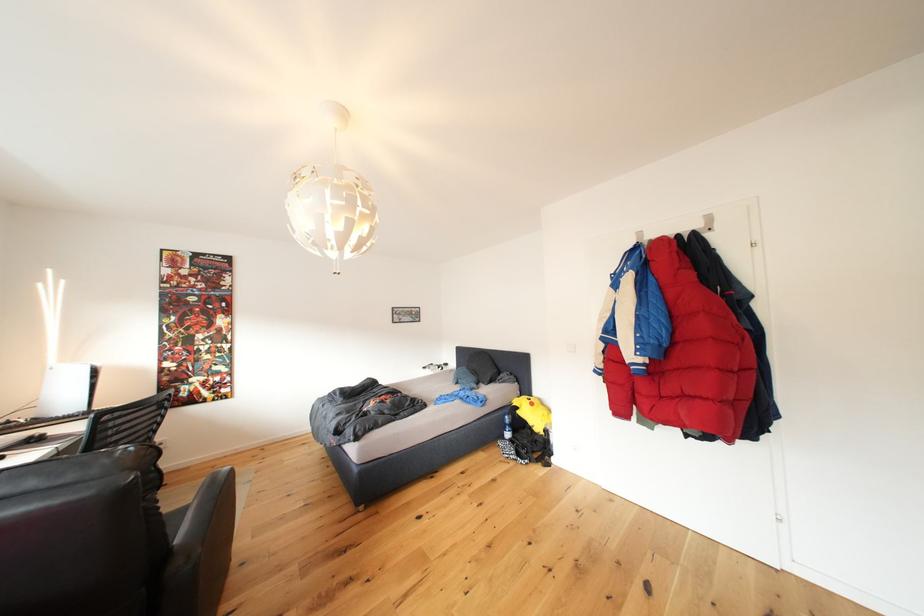
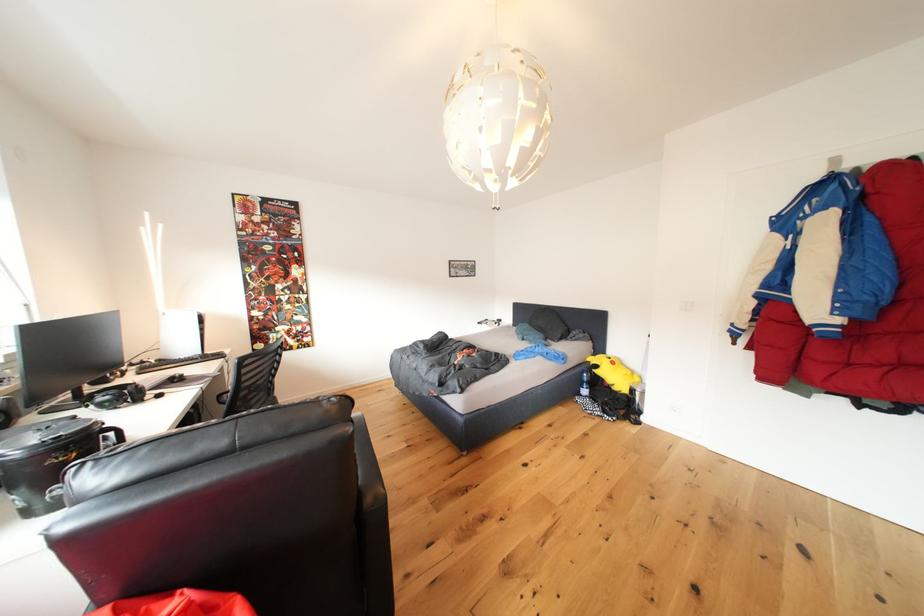
Question: The first image is from the beginning of the video and the second image is from the end. How did the camera likely rotate when shooting the video?

Choices:
 (A) Left
 (B) Right
 (C) Up
 (D) Down

Answer: (D)